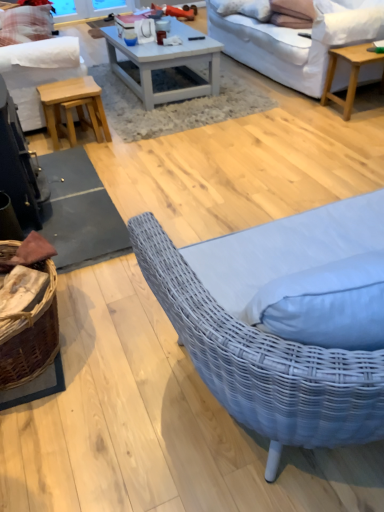
You are a GUI agent. You are given a task and a screenshot of the screen. Output one action in this format:
    pyautogui.click(x=<x>, y=<y>)
    Task: Click on the white painted wood coffee table at center, the 2th coffee table positioned from the right
    
    Given the screenshot: What is the action you would take?
    (x=167, y=64)

Locate an element on the screen. The image size is (384, 512). suede-like beige pillow at upper right, the 1th pillow when ordered from right to left is located at coordinates (294, 8).

The height and width of the screenshot is (512, 384). Describe the element at coordinates (72, 106) in the screenshot. I see `light brown wooden stool at left` at that location.

What is the approximate height of plaid fabric pillow at upper left, acting as the 1th pillow starting from the left?

plaid fabric pillow at upper left, acting as the 1th pillow starting from the left, is 20.32 inches in height.

The image size is (384, 512). Find the location of `light wood/texture coffee table at upper right, marked as the second coffee table in a left-to-right arrangement`. light wood/texture coffee table at upper right, marked as the second coffee table in a left-to-right arrangement is located at coordinates (350, 74).

Considering the positions of objects suede-like beige pillow at upper right, which is the third pillow in back-to-front order, and light wood/texture coffee table at upper right, which is the first coffee table in right-to-left order, in the image provided, who is in front, suede-like beige pillow at upper right, which is the third pillow in back-to-front order, or light wood/texture coffee table at upper right, which is the first coffee table in right-to-left order,?

light wood/texture coffee table at upper right, which is the first coffee table in right-to-left order, is closer to the camera.

Is point (293, 0) closer to viewer compared to point (329, 49)?

No, (293, 0) is behind (329, 49).

Is light wood/texture coffee table at upper right, which is the first coffee table in right-to-left order, a part of suede-like beige pillow at upper right, the 3th pillow positioned from the top?

No.

Is suede-like beige pillow at upper right, marked as the third pillow in a left-to-right arrangement, wider or thinner than light wood/texture coffee table at upper right, which is the first coffee table in right-to-left order?

Clearly, suede-like beige pillow at upper right, marked as the third pillow in a left-to-right arrangement, has less width compared to light wood/texture coffee table at upper right, which is the first coffee table in right-to-left order.

From the image's perspective, which object appears higher, suede-like beige pillow at upper right, marked as the third pillow in a left-to-right arrangement, or white fabric studio couch at upper right, the 1th studio couch when ordered from right to left?

white fabric studio couch at upper right, the 1th studio couch when ordered from right to left.

Is suede-like beige pillow at upper right, marked as the third pillow in a left-to-right arrangement, to the left of white fabric studio couch at upper right, the 1th studio couch when ordered from right to left, from the viewer's perspective?

Yes, suede-like beige pillow at upper right, marked as the third pillow in a left-to-right arrangement, is to the left of white fabric studio couch at upper right, the 1th studio couch when ordered from right to left.

Does white textured pillow at upper center, acting as the second pillow starting from the left, turn towards light brown wooden stool at left?

No.

Does point (223, 9) appear closer or farther from the camera than point (71, 92)?

Point (223, 9) is positioned farther from the camera compared to point (71, 92).

In terms of height, does white textured pillow at upper center, acting as the second pillow starting from the left, look taller or shorter compared to light brown wooden stool at left?

white textured pillow at upper center, acting as the second pillow starting from the left, is shorter than light brown wooden stool at left.

Consider the image. Considering the relative sizes of light brown wooden stool at left and white fabric studio couch at left, which is counted as the first studio couch, starting from the left, in the image provided, is light brown wooden stool at left bigger than white fabric studio couch at left, which is counted as the first studio couch, starting from the left,?

Incorrect, light brown wooden stool at left is not larger than white fabric studio couch at left, which is counted as the first studio couch, starting from the left.

Is light brown wooden stool at left wider than white fabric studio couch at left, placed as the 2th studio couch when sorted from right to left?

Incorrect, the width of light brown wooden stool at left does not surpass that of white fabric studio couch at left, placed as the 2th studio couch when sorted from right to left.

Does white painted wood coffee table at center, the first coffee table in the left-to-right sequence, appear on the left side of suede-like beige pillow at upper right, marked as the third pillow in a left-to-right arrangement?

Indeed, white painted wood coffee table at center, the first coffee table in the left-to-right sequence, is positioned on the left side of suede-like beige pillow at upper right, marked as the third pillow in a left-to-right arrangement.

Is point (208, 76) positioned after point (289, 6)?

No, (208, 76) is closer to viewer.

Is white painted wood coffee table at center, the first coffee table in the left-to-right sequence, inside or outside of suede-like beige pillow at upper right, marked as the third pillow in a left-to-right arrangement?

white painted wood coffee table at center, the first coffee table in the left-to-right sequence, is located beyond the bounds of suede-like beige pillow at upper right, marked as the third pillow in a left-to-right arrangement.

Can you confirm if plaid fabric pillow at upper left, which ranks as the first pillow in back-to-front order, is taller than light brown wooden stool at left?

Yes, plaid fabric pillow at upper left, which ranks as the first pillow in back-to-front order, is taller than light brown wooden stool at left.

Is plaid fabric pillow at upper left, which ranks as the first pillow in back-to-front order, positioned with its back to light brown wooden stool at left?

No, light brown wooden stool at left is not at the back of plaid fabric pillow at upper left, which ranks as the first pillow in back-to-front order.

From a real-world perspective, is plaid fabric pillow at upper left, which ranks as the third pillow in front-to-back order, physically located above or below light brown wooden stool at left?

Clearly, from a real-world perspective, plaid fabric pillow at upper left, which ranks as the third pillow in front-to-back order, is above light brown wooden stool at left.

Between plaid fabric pillow at upper left, acting as the 1th pillow starting from the left, and light brown wooden stool at left, which one appears on the right side from the viewer's perspective?

Positioned to the right is light brown wooden stool at left.

Which object is further away from the camera taking this photo, white fabric studio couch at upper right, the 1th studio couch when ordered from right to left, or light wood/texture coffee table at upper right, marked as the second coffee table in a left-to-right arrangement?

light wood/texture coffee table at upper right, marked as the second coffee table in a left-to-right arrangement.

Who is shorter, white fabric studio couch at upper right, the 1th studio couch when ordered from right to left, or light wood/texture coffee table at upper right, marked as the second coffee table in a left-to-right arrangement?

light wood/texture coffee table at upper right, marked as the second coffee table in a left-to-right arrangement.

Which is correct: white fabric studio couch at upper right, the 1th studio couch when ordered from right to left, is inside light wood/texture coffee table at upper right, marked as the second coffee table in a left-to-right arrangement, or outside of it?

white fabric studio couch at upper right, the 1th studio couch when ordered from right to left, is located beyond the bounds of light wood/texture coffee table at upper right, marked as the second coffee table in a left-to-right arrangement.

Locate an element on the screen. The height and width of the screenshot is (512, 384). the 2nd coffee table positioned below the white fabric studio couch at upper right, the 1th studio couch when ordered from right to left (from the image's perspective) is located at coordinates (350, 74).

Which coffee table is the 2nd one when counting from the front of the suede-like beige pillow at upper right, marked as the third pillow in a left-to-right arrangement? Please provide its 2D coordinates.

[(350, 74)]

I want to click on pillow below the white fabric studio couch at upper right, which is counted as the 2th studio couch, starting from the left (from the image's perspective), so click(294, 8).

Based on their spatial positions, is light brown wooden stool at left or white fabric studio couch at upper right, the 1th studio couch when ordered from right to left, closer to white painted wood coffee table at center, the first coffee table in the left-to-right sequence?

light brown wooden stool at left is closer to white painted wood coffee table at center, the first coffee table in the left-to-right sequence.

Estimate the real-world distances between objects in this image. Which object is closer to suede-like beige pillow at upper right, marked as the third pillow in a left-to-right arrangement, white fabric studio couch at left, placed as the 2th studio couch when sorted from right to left, or light brown wooden stool at left?

Based on the image, light brown wooden stool at left appears to be nearer to suede-like beige pillow at upper right, marked as the third pillow in a left-to-right arrangement.

Consider the image. Considering their positions, is light brown wooden stool at left positioned further to white textured pillow at upper center, the second pillow from the bottom, than plaid fabric pillow at upper left, acting as the 1th pillow starting from the left?

Based on the image, light brown wooden stool at left appears to be further to white textured pillow at upper center, the second pillow from the bottom.

Estimate the real-world distances between objects in this image. Which object is further from white fabric studio couch at left, which is counted as the first studio couch, starting from the left, white textured pillow at upper center, the 2th pillow positioned from the top, or light brown wooden stool at left?

white textured pillow at upper center, the 2th pillow positioned from the top, is further to white fabric studio couch at left, which is counted as the first studio couch, starting from the left.

Considering their positions, is suede-like beige pillow at upper right, which is the third pillow in back-to-front order, positioned closer to white fabric studio couch at upper right, which is counted as the 2th studio couch, starting from the left, than white textured pillow at upper center, the second pillow positioned from the right?

Based on the image, suede-like beige pillow at upper right, which is the third pillow in back-to-front order, appears to be nearer to white fabric studio couch at upper right, which is counted as the 2th studio couch, starting from the left.

Considering their positions, is white painted wood coffee table at center, the first coffee table in the left-to-right sequence, positioned further to plaid fabric pillow at upper left, acting as the 3th pillow starting from the right, than white fabric studio couch at left, placed as the 2th studio couch when sorted from right to left?

white painted wood coffee table at center, the first coffee table in the left-to-right sequence, is positioned further to the anchor plaid fabric pillow at upper left, acting as the 3th pillow starting from the right.

From the image, which object appears to be nearer to suede-like beige pillow at upper right, marked as the third pillow in a left-to-right arrangement, light wood/texture coffee table at upper right, which is the first coffee table in right-to-left order, or white fabric studio couch at upper right, which is counted as the 2th studio couch, starting from the left?

white fabric studio couch at upper right, which is counted as the 2th studio couch, starting from the left, lies closer to suede-like beige pillow at upper right, marked as the third pillow in a left-to-right arrangement, than the other object.

Based on their spatial positions, is white fabric studio couch at left, which is counted as the first studio couch, starting from the left, or light brown wooden stool at left further from plaid fabric pillow at upper left, acting as the 3th pillow starting from the right?

Among the two, light brown wooden stool at left is located further to plaid fabric pillow at upper left, acting as the 3th pillow starting from the right.

You are a GUI agent. You are given a task and a screenshot of the screen. Output one action in this format:
    pyautogui.click(x=<x>, y=<y>)
    Task: Click on the pillow between light brown wooden stool at left and suede-like beige pillow at upper right, the 3th pillow positioned from the top, in the horizontal direction
    Image resolution: width=384 pixels, height=512 pixels.
    Given the screenshot: What is the action you would take?
    pyautogui.click(x=244, y=8)

Where is `studio couch located between plaid fabric pillow at upper left, acting as the 3th pillow starting from the right, and white fabric studio couch at upper right, the 1th studio couch when ordered from right to left, in the left-right direction`? studio couch located between plaid fabric pillow at upper left, acting as the 3th pillow starting from the right, and white fabric studio couch at upper right, the 1th studio couch when ordered from right to left, in the left-right direction is located at coordinates (38, 72).

The width and height of the screenshot is (384, 512). Identify the location of studio couch between plaid fabric pillow at upper left, acting as the 1th pillow starting from the left, and suede-like beige pillow at upper right, placed as the first pillow when sorted from bottom to top. (38, 72).

Where is `pillow between white textured pillow at upper center, the 2th pillow positioned from the top, and light wood/texture coffee table at upper right, which is the first coffee table in right-to-left order, in the up-down direction`? This screenshot has width=384, height=512. pillow between white textured pillow at upper center, the 2th pillow positioned from the top, and light wood/texture coffee table at upper right, which is the first coffee table in right-to-left order, in the up-down direction is located at coordinates (294, 8).